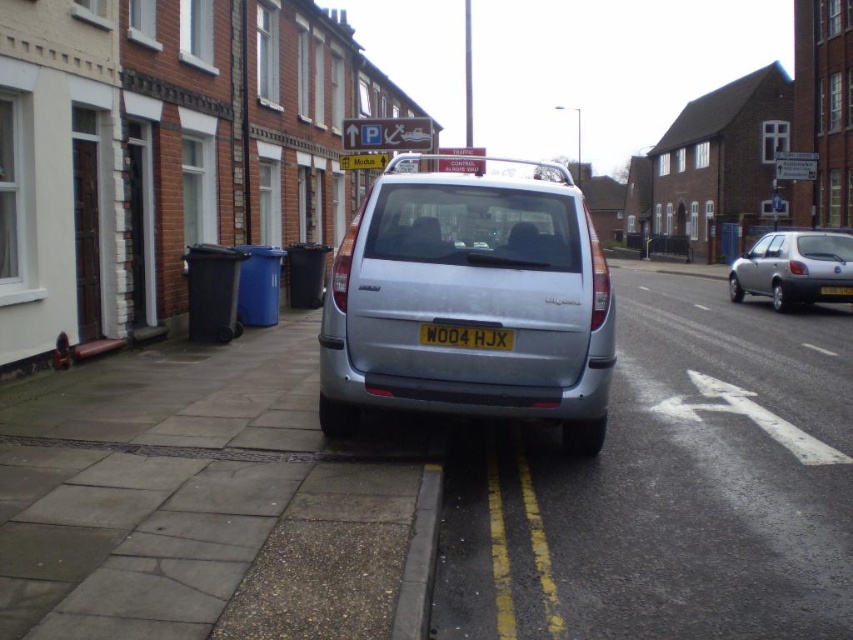
Which is behind, point (751, 259) or point (828, 294)?

Positioned behind is point (751, 259).

Is point (845, 269) positioned before point (836, 291)?

Yes, point (845, 269) is closer to viewer.

Does point (805, 236) lie in front of point (827, 294)?

No, it is not.

Locate an element on the screen. silver metallic hatchback at right is located at coordinates (793, 268).

Consider the image. Is silver metallic minivan at center to the left of white plastic license plate at center from the viewer's perspective?

Indeed, silver metallic minivan at center is positioned on the left side of white plastic license plate at center.

Is point (553, 227) farther from viewer compared to point (492, 342)?

Yes.

In order to click on silver metallic minivan at center in this screenshot , I will do `click(469, 298)`.

The image size is (853, 640). I want to click on silver metallic minivan at center, so click(x=469, y=298).

I want to click on white plastic license plate at center, so click(465, 337).

Is white plastic license plate at center taller than yellow matte license plate at center?

In fact, white plastic license plate at center may be shorter than yellow matte license plate at center.

Is point (437, 333) behind point (827, 289)?

No, it is not.

At what (x,y) coordinates should I click in order to perform the action: click on white plastic license plate at center. Please return your answer as a coordinate pair (x, y). The height and width of the screenshot is (640, 853). Looking at the image, I should click on (465, 337).